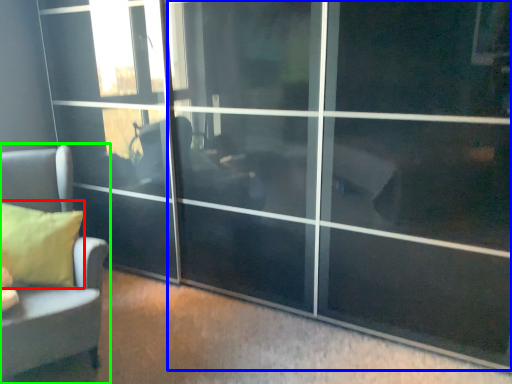
Question: Which is farther away from pillow (highlighted by a red box)? screen door (highlighted by a blue box) or furniture (highlighted by a green box)?

Choices:
 (A) screen door
 (B) furniture

Answer: (A)